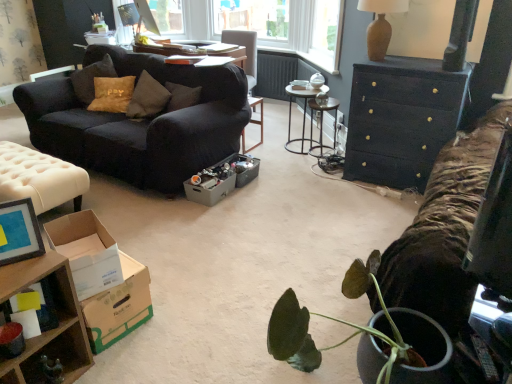
Question: Are gray cardboard box at center, which is the first cardboard box from back to front, and metallic gray box at center far apart?

Choices:
 (A) no
 (B) yes

Answer: (A)

Question: Is metallic gray box at center at the back of gray cardboard box at center, positioned as the third cardboard box in front-to-back order?

Choices:
 (A) no
 (B) yes

Answer: (A)

Question: From the image's perspective, is gray cardboard box at center, which is the first cardboard box from back to front, below metallic gray box at center?

Choices:
 (A) yes
 (B) no

Answer: (A)

Question: Is the position of gray cardboard box at center, which is the first cardboard box from back to front, less distant than that of metallic gray box at center?

Choices:
 (A) yes
 (B) no

Answer: (A)

Question: From a real-world perspective, is gray cardboard box at center, which is the first cardboard box from back to front, on top of metallic gray box at center?

Choices:
 (A) yes
 (B) no

Answer: (B)

Question: In the image, is brown cardboard box at lower left, the 2th cardboard box in the back-to-front sequence, positioned in front of or behind metallic silver desk at center?

Choices:
 (A) behind
 (B) front

Answer: (B)

Question: Considering the positions of point (94, 289) and point (313, 96), is point (94, 289) closer or farther from the camera than point (313, 96)?

Choices:
 (A) farther
 (B) closer

Answer: (B)

Question: Looking at the image, does brown cardboard box at lower left, the 2th cardboard box in the back-to-front sequence, seem bigger or smaller compared to metallic silver desk at center?

Choices:
 (A) big
 (B) small

Answer: (B)

Question: Is brown cardboard box at lower left, acting as the second cardboard box starting from the front, inside or outside of metallic silver desk at center?

Choices:
 (A) inside
 (B) outside

Answer: (B)

Question: Visually, is metallic silver desk at center positioned to the left or to the right of matte blue picture frame at lower left?

Choices:
 (A) right
 (B) left

Answer: (A)

Question: Considering the positions of metallic silver desk at center and matte blue picture frame at lower left in the image, is metallic silver desk at center taller or shorter than matte blue picture frame at lower left?

Choices:
 (A) tall
 (B) short

Answer: (A)

Question: Considering the positions of point (307, 97) and point (25, 248), is point (307, 97) closer or farther from the camera than point (25, 248)?

Choices:
 (A) closer
 (B) farther

Answer: (B)

Question: From a real-world perspective, relative to matte blue picture frame at lower left, is metallic silver desk at center vertically above or below?

Choices:
 (A) below
 (B) above

Answer: (A)

Question: Considering the positions of metallic gray box at center and brown textured vase at upper right in the image, is metallic gray box at center wider or thinner than brown textured vase at upper right?

Choices:
 (A) wide
 (B) thin

Answer: (B)

Question: Do you think metallic gray box at center is within brown textured vase at upper right, or outside of it?

Choices:
 (A) outside
 (B) inside

Answer: (A)